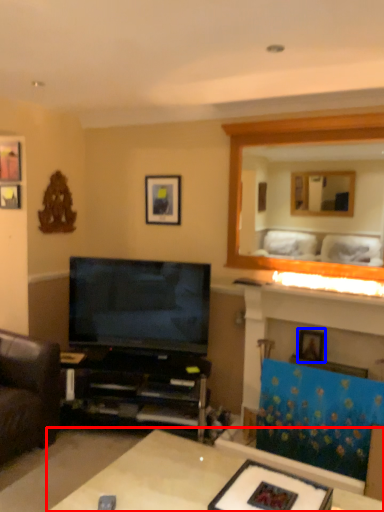
Question: Which object is closer to the camera taking this photo, table (highlighted by a red box) or picture frame (highlighted by a blue box)?

Choices:
 (A) table
 (B) picture frame

Answer: (A)